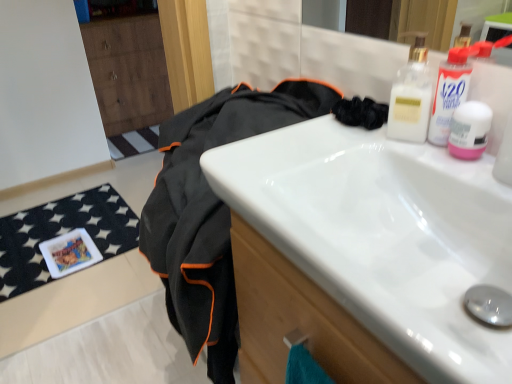
Question: In terms of width, does white glossy sink at center look wider or thinner when compared to black fabric at center?

Choices:
 (A) thin
 (B) wide

Answer: (A)

Question: From a real-world perspective, is white glossy sink at center physically located above or below black fabric at center?

Choices:
 (A) above
 (B) below

Answer: (A)

Question: Based on their sizes in the image, would you say white glossy sink at center is bigger or smaller than black fabric at center?

Choices:
 (A) small
 (B) big

Answer: (A)

Question: Based on their sizes in the image, would you say black fabric at center is bigger or smaller than white glossy sink at center?

Choices:
 (A) big
 (B) small

Answer: (A)

Question: Do you think black fabric at center is within white glossy sink at center, or outside of it?

Choices:
 (A) inside
 (B) outside

Answer: (B)

Question: From the image's perspective, is black fabric at center positioned above or below white glossy sink at center?

Choices:
 (A) above
 (B) below

Answer: (B)

Question: From a real-world perspective, is black fabric at center positioned above or below white glossy sink at center?

Choices:
 (A) below
 (B) above

Answer: (A)